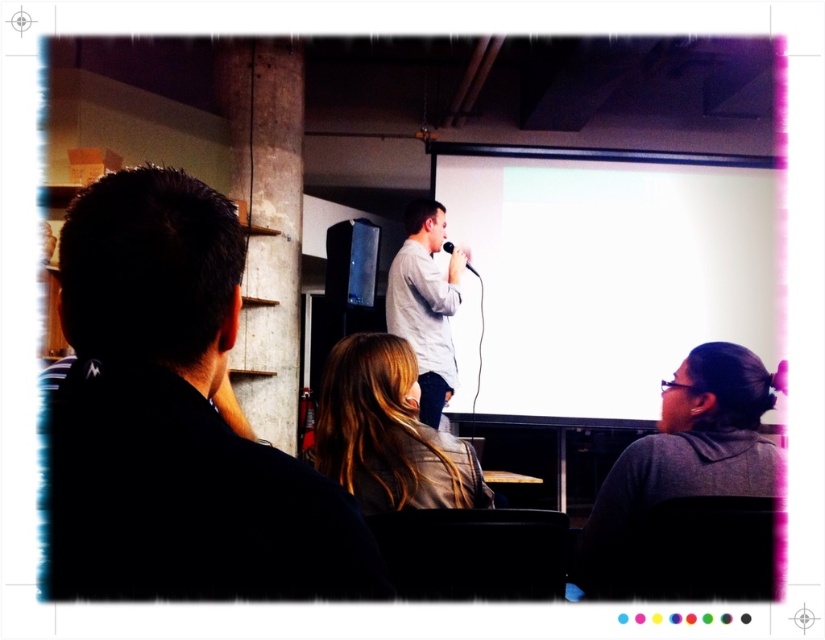
Question: Which object is positioned closest to the blonde hair at center?

Choices:
 (A) white matte projection screen at center
 (B) gray matte jacket at lower right
 (C) white matte shirt at center
 (D) black matte jacket at left

Answer: (B)

Question: Where is black matte jacket at left located in relation to gray matte jacket at lower right in the image?

Choices:
 (A) above
 (B) below

Answer: (A)

Question: Which of these objects is positioned closest to the white matte projection screen at center?

Choices:
 (A) gray matte jacket at lower right
 (B) black matte jacket at left
 (C) blonde hair at center
 (D) white matte shirt at center

Answer: (D)

Question: Which object appears farthest from the camera in this image?

Choices:
 (A) blonde hair at center
 (B) black matte jacket at left
 (C) gray matte jacket at lower right

Answer: (A)

Question: Is black matte jacket at left to the left of white matte shirt at center from the viewer's perspective?

Choices:
 (A) no
 (B) yes

Answer: (B)

Question: Does black matte jacket at left appear on the right side of blonde hair at center?

Choices:
 (A) yes
 (B) no

Answer: (B)